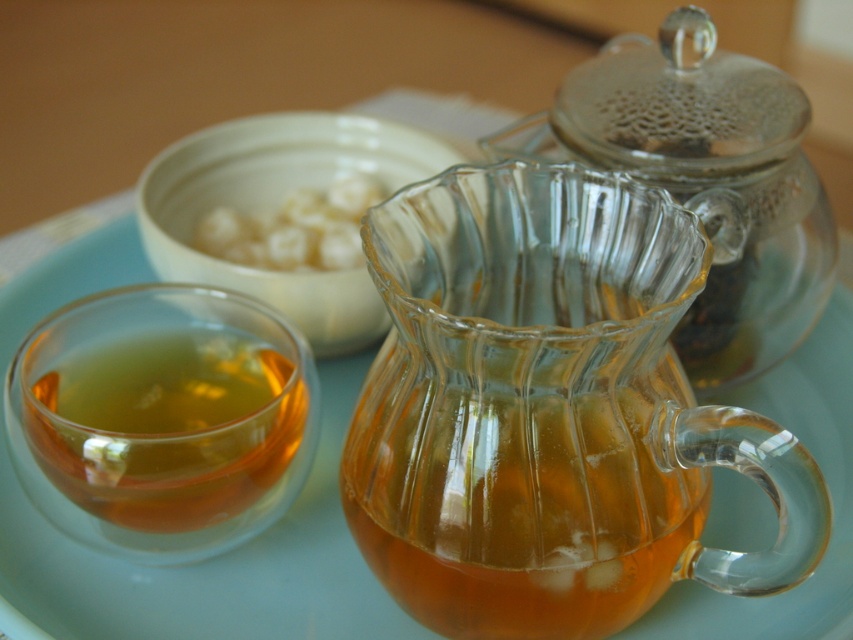
From the picture: You are a tea lover who wants to pour the tea from the glass teapot into the translucent glass cup at left and the white creamy dumplings at upper center. Which object should you pour the tea into first based on their positions?

You should pour the tea into the translucent glass cup at left first because it is positioned to the left of the white creamy dumplings at upper center, making it closer to the teapot.

You are standing in front of the tea setting and want to place a small spoon between the two points, point (712, 273) and point (262, 163). Which point should you place the spoon closer to if you want it to be closer to the viewer?

You should place the spoon closer to point (712, 273) because it is in front of point (262, 163), making it closer to the viewer.

You are a tea server preparing for a ceremony. You have a transparent glass teapot at center and a white matte bowl at upper center on the table. Which object should you use to pour tea into cups to ensure it doesn

The transparent glass teapot at center should be used to pour tea into cups because it has a smaller size compared to the white matte bowl at upper center, making it more suitable for pouring.